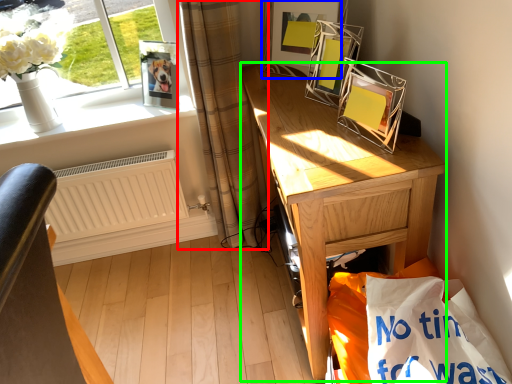
Question: Which object is positioned farthest from curtain (highlighted by a red box)? Select from picture frame (highlighted by a blue box) and desk (highlighted by a green box).

Choices:
 (A) picture frame
 (B) desk

Answer: (B)